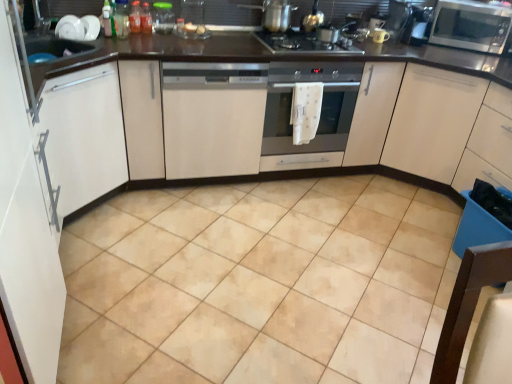
Question: From a real-world perspective, is beige ceramic tile at center physically above matte ceramic mug at upper center, the first appliance from the right?

Choices:
 (A) yes
 (B) no

Answer: (B)

Question: From the image's perspective, would you say beige ceramic tile at center is positioned over matte ceramic mug at upper center, the first appliance from the right?

Choices:
 (A) no
 (B) yes

Answer: (A)

Question: From the image's perspective, does beige ceramic tile at center appear lower than matte ceramic mug at upper center, marked as the third appliance in a left-to-right arrangement?

Choices:
 (A) yes
 (B) no

Answer: (A)

Question: Does beige ceramic tile at center appear on the left side of matte ceramic mug at upper center, marked as the third appliance in a left-to-right arrangement?

Choices:
 (A) no
 (B) yes

Answer: (B)

Question: Can you confirm if beige ceramic tile at center is thinner than matte ceramic mug at upper center, marked as the third appliance in a left-to-right arrangement?

Choices:
 (A) no
 (B) yes

Answer: (A)

Question: Considering the relative sizes of beige ceramic tile at center and matte ceramic mug at upper center, the first appliance from the right, in the image provided, is beige ceramic tile at center smaller than matte ceramic mug at upper center, the first appliance from the right,?

Choices:
 (A) yes
 (B) no

Answer: (B)

Question: Are translucent plastic bottle at upper center, the 1th bottle positioned from the right, and beige ceramic tile at center far apart?

Choices:
 (A) yes
 (B) no

Answer: (A)

Question: Does translucent plastic bottle at upper center, marked as the third bottle in a left-to-right arrangement, appear on the right side of beige ceramic tile at center?

Choices:
 (A) yes
 (B) no

Answer: (B)

Question: From a real-world perspective, is translucent plastic bottle at upper center, marked as the third bottle in a left-to-right arrangement, physically below beige ceramic tile at center?

Choices:
 (A) yes
 (B) no

Answer: (B)

Question: Is beige ceramic tile at center completely or partially inside translucent plastic bottle at upper center, the 1th bottle positioned from the right?

Choices:
 (A) no
 (B) yes

Answer: (A)

Question: Does translucent plastic bottle at upper center, marked as the third bottle in a left-to-right arrangement, have a greater height compared to beige ceramic tile at center?

Choices:
 (A) no
 (B) yes

Answer: (B)

Question: Does translucent plastic bottle at upper center, the 1th bottle positioned from the right, have a lesser width compared to beige ceramic tile at center?

Choices:
 (A) no
 (B) yes

Answer: (B)

Question: Is black glass gas stove at center thinner than translucent plastic bottle at upper center, which is the second bottle from left to right?

Choices:
 (A) no
 (B) yes

Answer: (A)